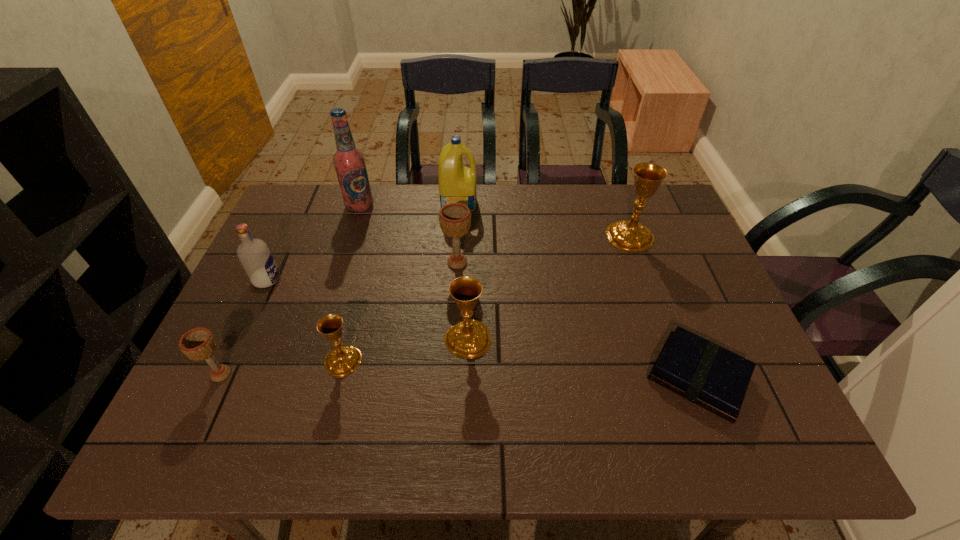
Where is `blue alcohol`? The width and height of the screenshot is (960, 540). blue alcohol is located at coordinates (349, 162).

Locate an element on the screen. The image size is (960, 540). the tallest object is located at coordinates (349, 162).

The image size is (960, 540). I want to click on detergent, so click(x=457, y=183).

Identify the location of the tallest chalice. (628, 235).

Where is `the rightmost chalice`? The image size is (960, 540). the rightmost chalice is located at coordinates (628, 235).

I want to click on vodka, so click(256, 258).

Find the location of a particular element. the second gold chalice from right to left is located at coordinates (470, 338).

Identify the location of the bigger beige chalice. The image size is (960, 540). (455, 218).

Where is `the right beige chalice`? the right beige chalice is located at coordinates (455, 218).

Locate an element on the screen. The height and width of the screenshot is (540, 960). the smaller beige chalice is located at coordinates pos(198,344).